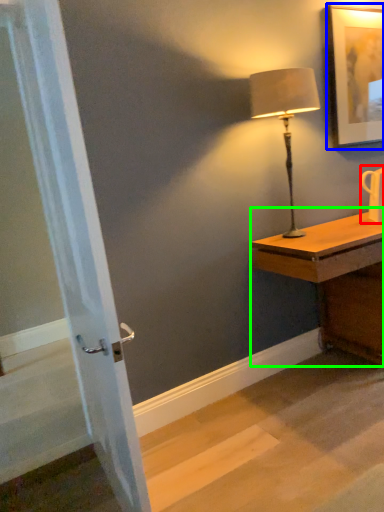
Question: Considering the real-world distances, which object is closest to mug (highlighted by a red box)? picture frame (highlighted by a blue box) or desk (highlighted by a green box).

Choices:
 (A) picture frame
 (B) desk

Answer: (B)